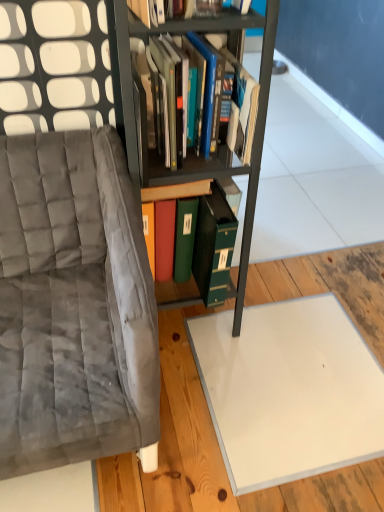
Question: Which direction should I rotate to look at green matte file at center, the 1th book in the bottom-to-top sequence, — up or down?

Choices:
 (A) down
 (B) up

Answer: (B)

Question: Can we say hardcover books at center, which ranks as the second book in bottom-to-top order, lies outside green matte file at center, the second book viewed from the top?

Choices:
 (A) yes
 (B) no

Answer: (A)

Question: From a real-world perspective, is hardcover books at center, the 1th book in the top-to-bottom sequence, under green matte file at center, the second book viewed from the top?

Choices:
 (A) no
 (B) yes

Answer: (A)

Question: Considering the relative positions of hardcover books at center, the 1th book in the top-to-bottom sequence, and green matte file at center, the 1th book in the bottom-to-top sequence, in the image provided, is hardcover books at center, the 1th book in the top-to-bottom sequence, to the right of green matte file at center, the 1th book in the bottom-to-top sequence, from the viewer's perspective?

Choices:
 (A) no
 (B) yes

Answer: (B)

Question: Are hardcover books at center, the 1th book in the top-to-bottom sequence, and green matte file at center, the second book viewed from the top, located far from each other?

Choices:
 (A) no
 (B) yes

Answer: (A)

Question: Is green matte file at center, the 1th book in the bottom-to-top sequence, a part of hardcover books at center, the 1th book in the top-to-bottom sequence?

Choices:
 (A) no
 (B) yes

Answer: (A)

Question: Can you confirm if hardcover books at center, which ranks as the second book in bottom-to-top order, is thinner than green matte file at center, the second book viewed from the top?

Choices:
 (A) no
 (B) yes

Answer: (B)

Question: Could you tell me if metallic black bookcase at center is turned towards velvet gray chair at left?

Choices:
 (A) yes
 (B) no

Answer: (B)

Question: Can you confirm if metallic black bookcase at center is taller than velvet gray chair at left?

Choices:
 (A) yes
 (B) no

Answer: (A)

Question: Considering the relative positions of metallic black bookcase at center and velvet gray chair at left in the image provided, is metallic black bookcase at center to the left of velvet gray chair at left from the viewer's perspective?

Choices:
 (A) no
 (B) yes

Answer: (A)

Question: From a real-world perspective, is metallic black bookcase at center positioned under velvet gray chair at left based on gravity?

Choices:
 (A) no
 (B) yes

Answer: (A)

Question: Is metallic black bookcase at center bigger than velvet gray chair at left?

Choices:
 (A) no
 (B) yes

Answer: (A)

Question: Can you confirm if metallic black bookcase at center is wider than velvet gray chair at left?

Choices:
 (A) no
 (B) yes

Answer: (A)

Question: Is velvet gray chair at left facing towards metallic black bookcase at center?

Choices:
 (A) yes
 (B) no

Answer: (B)